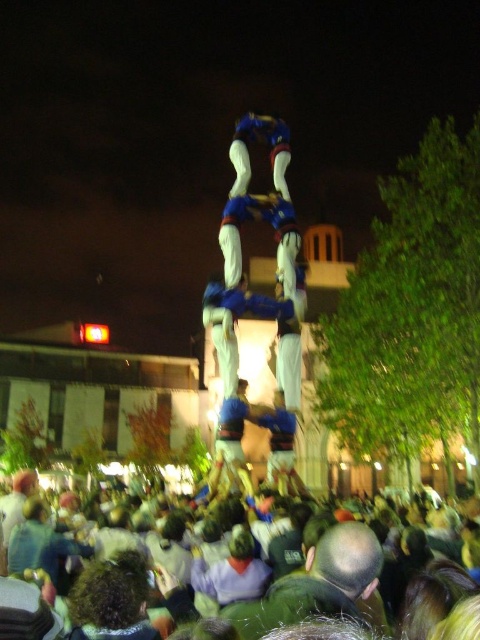
You are a photographer standing at the camera position. You want to take a photo of the dark green fabric crowd at lower center. Is the distance between you and the crowd sufficient to capture a clear image with your standard 50mm lens?

The dark green fabric crowd at lower center and camera are 154.19 feet apart from each other. A standard 50mm lens can focus on subjects at that distance, so yes, the distance is sufficient to capture a clear image.

Looking at this image, looking at the nighttime scene with the human tower, you notice two objects labeled as the blue fabric human at center and the blue fabric pants at center. Which one is positioned more to the left?

The blue fabric human at center is positioned more to the left than the blue fabric pants at center.